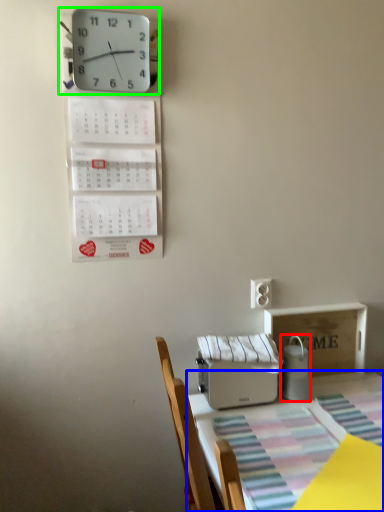
Question: Which is farther away from appliance (highlighted by a red box)? table (highlighted by a blue box) or wall clock (highlighted by a green box)?

Choices:
 (A) table
 (B) wall clock

Answer: (B)